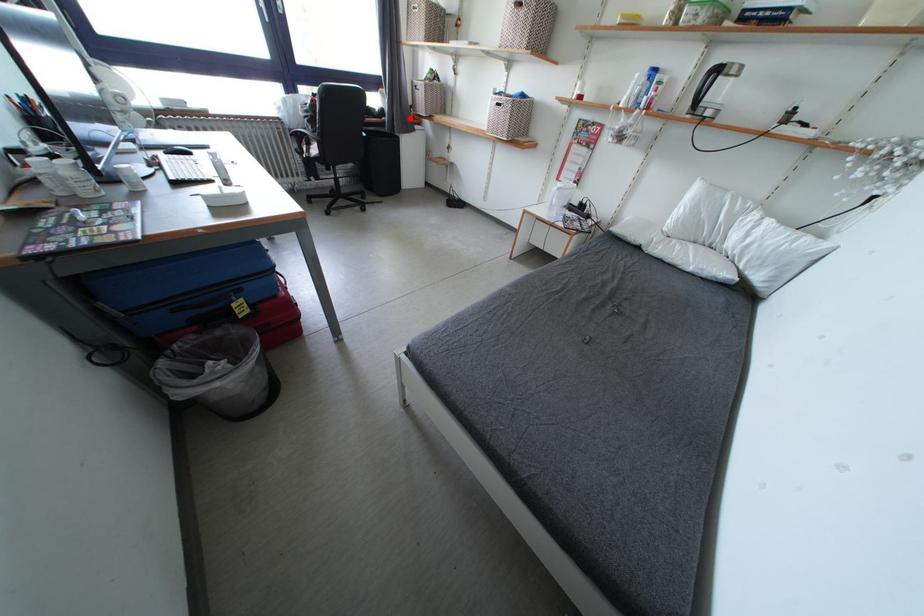
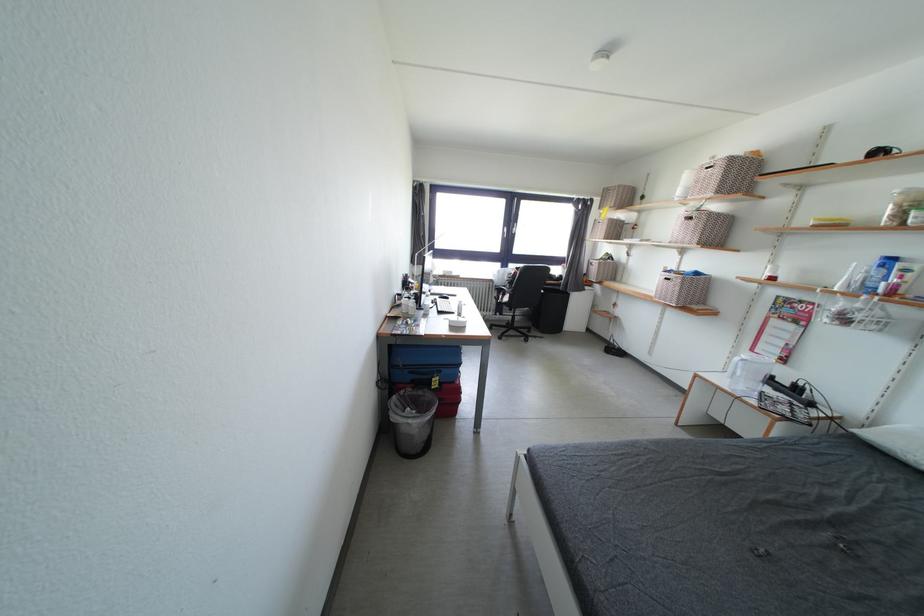
Question: A red point is marked in image1. In image2, is the corresponding 3D point closer to the camera or farther? Reply with the corresponding letter.

Choices:
 (A) The corresponding 3D point is closer.
 (B) The corresponding 3D point is farther.

Answer: (B)